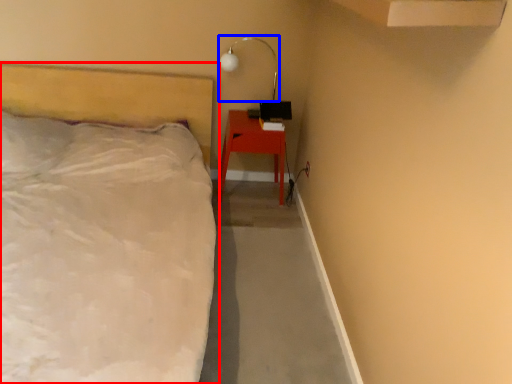
Question: Which object appears farthest to the camera in this image, bed (highlighted by a red box) or lamp (highlighted by a blue box)?

Choices:
 (A) bed
 (B) lamp

Answer: (B)